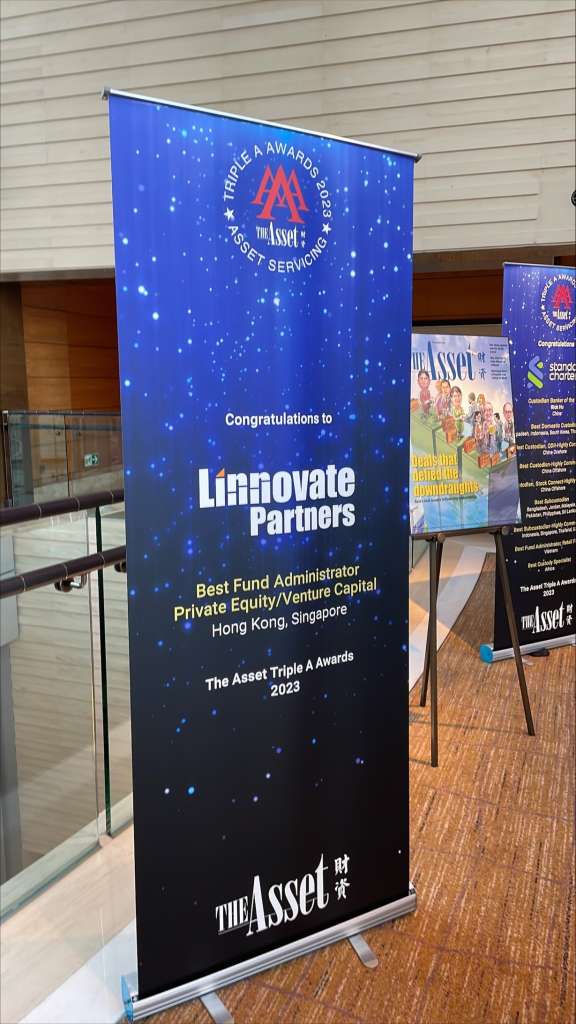
Image resolution: width=576 pixels, height=1024 pixels. In order to click on standing sign holder in this screenshot , I will do `click(161, 997)`, `click(500, 651)`.